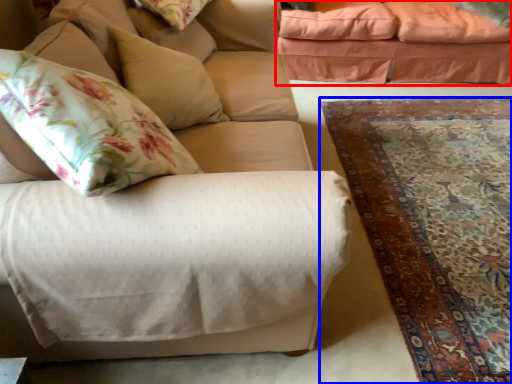
Question: Among these objects, which one is nearest to the camera, studio couch (highlighted by a red box) or mat (highlighted by a blue box)?

Choices:
 (A) studio couch
 (B) mat

Answer: (B)